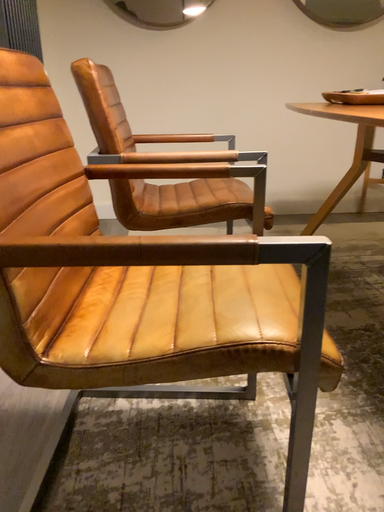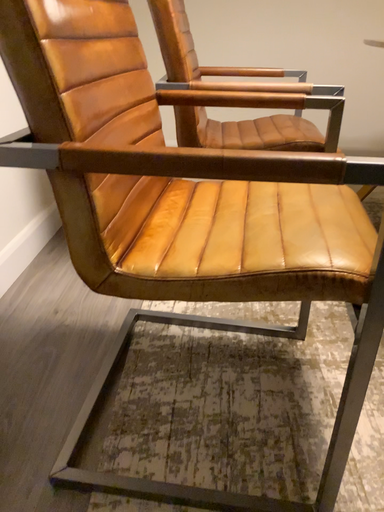
Question: Which way did the camera rotate in the video?

Choices:
 (A) rotated right
 (B) rotated left

Answer: (B)